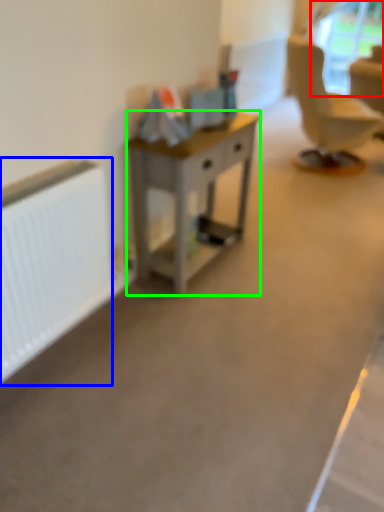
Question: Which object is the closest to the window screen (highlighted by a red box)? Choose among these: radiator (highlighted by a blue box) or desk (highlighted by a green box).

Choices:
 (A) radiator
 (B) desk

Answer: (B)